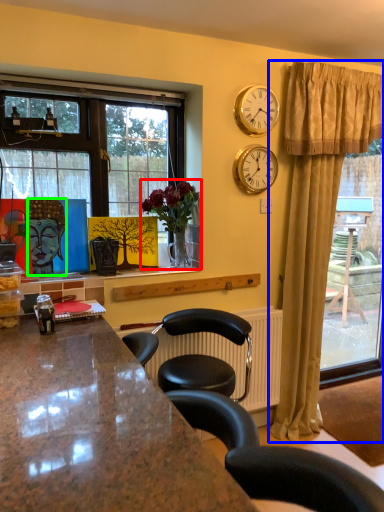
Question: Based on their relative distances, which object is farther from houseplant (highlighted by a red box)? Choose from curtain (highlighted by a blue box) and person (highlighted by a green box).

Choices:
 (A) curtain
 (B) person

Answer: (A)